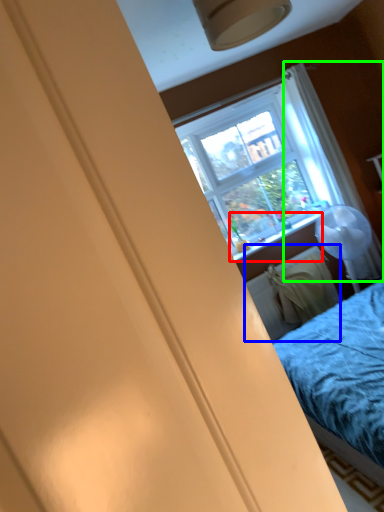
Question: Which object is the closest to the window sill (highlighted by a red box)? Choose among these: radiator (highlighted by a blue box) or curtain (highlighted by a green box).

Choices:
 (A) radiator
 (B) curtain

Answer: (A)